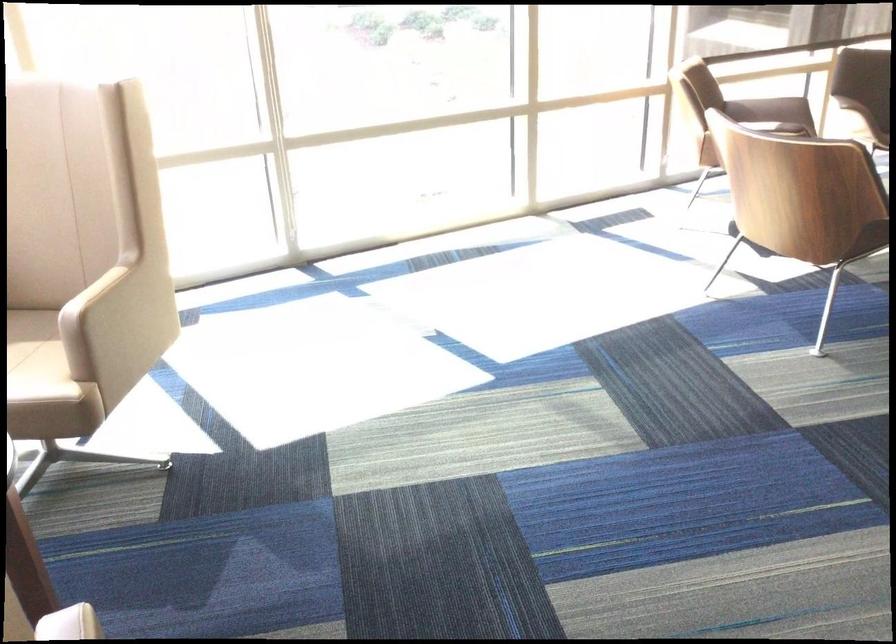
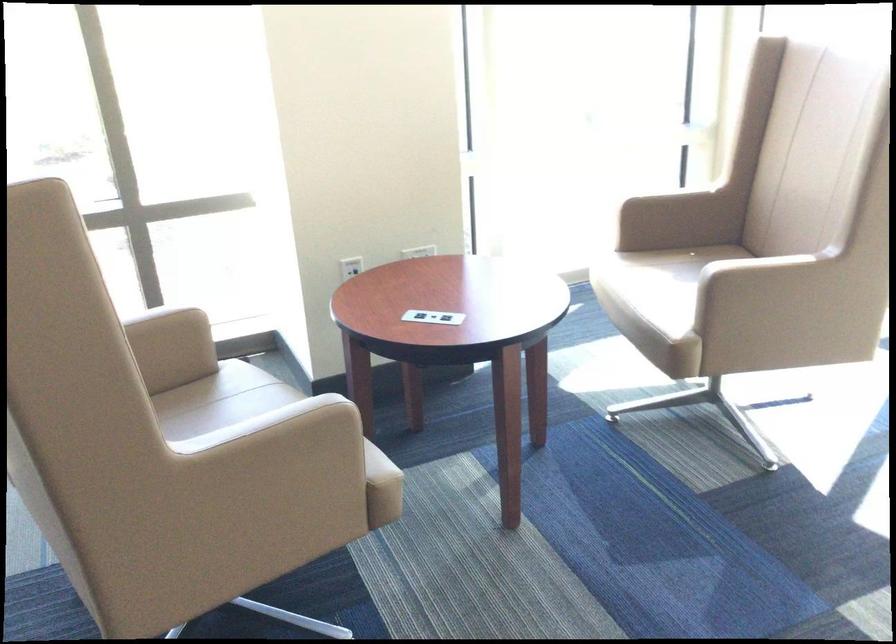
Question: I am providing you with two images of the same scene from different viewpoints. Which of the following objects are not visible in image2?

Choices:
 (A) beige chair sitting surface
 (B) power outlet hub
 (C) beige chair armrest
 (D) none of these

Answer: (D)